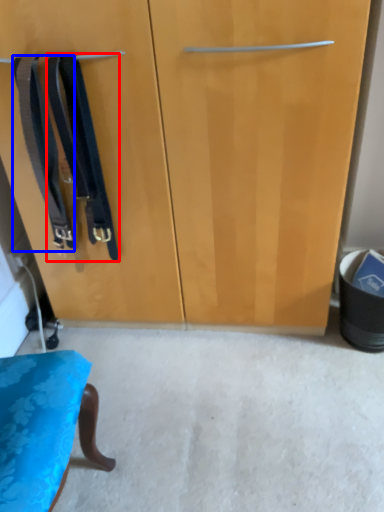
Question: Which object appears farthest to the camera in this image, suspenders (highlighted by a red box) or suspenders (highlighted by a blue box)?

Choices:
 (A) suspenders
 (B) suspenders

Answer: (B)